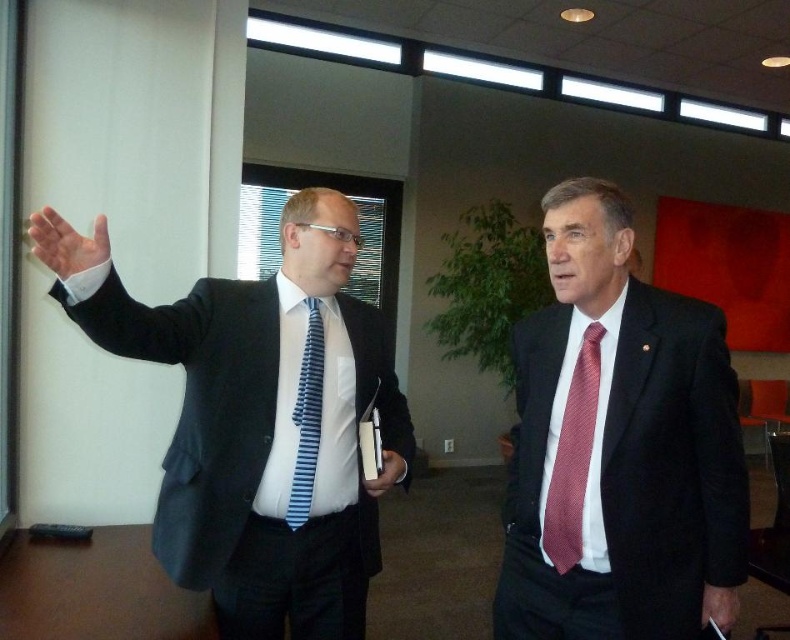
Question: Considering the real-world distances, which object is farthest from the matte black suit at left?

Choices:
 (A) matte black pen at lower right
 (B) matte black folder at center
 (C) matte black suit at right
 (D) blue striped tie at center

Answer: (A)

Question: Is matte black suit at right wider than red textured tie at right?

Choices:
 (A) yes
 (B) no

Answer: (A)

Question: Is matte black pen at lower right below matte black folder at center?

Choices:
 (A) yes
 (B) no

Answer: (A)

Question: Which of the following is the farthest from the observer?

Choices:
 (A) (40, 256)
 (B) (596, 348)
 (C) (720, 321)
 (D) (311, 588)

Answer: (D)

Question: Which point appears closest to the camera in this image?

Choices:
 (A) (40, 228)
 (B) (587, 417)
 (C) (367, 492)

Answer: (A)

Question: Is red textured tie at right closer to camera compared to white matte hand at upper left?

Choices:
 (A) no
 (B) yes

Answer: (A)